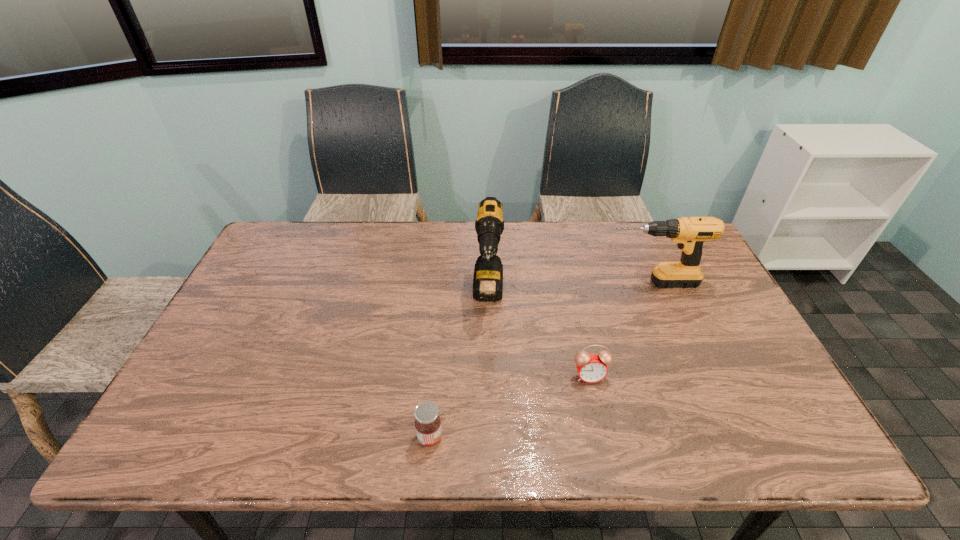
The height and width of the screenshot is (540, 960). Identify the location of empty location between the leftmost object and the third farthest object. (510, 407).

The height and width of the screenshot is (540, 960). Identify the location of empty space between the left drill and the third object from left to right. (539, 336).

I want to click on free space between the left drill and the jam, so click(459, 367).

At what (x,y) coordinates should I click in order to perform the action: click on empty space between the second object from left to right and the leftmost object. Please return your answer as a coordinate pair (x, y). The width and height of the screenshot is (960, 540). Looking at the image, I should click on (459, 367).

Locate an element on the screen. Image resolution: width=960 pixels, height=540 pixels. free space between the right drill and the left drill is located at coordinates (569, 289).

Image resolution: width=960 pixels, height=540 pixels. I want to click on free point between the second object from left to right and the jam, so click(x=459, y=367).

In order to click on vacant area that lies between the third farthest object and the right drill in this screenshot , I will do tap(619, 330).

This screenshot has height=540, width=960. I want to click on unoccupied area between the right drill and the jam, so click(x=540, y=360).

The width and height of the screenshot is (960, 540). Find the location of `free space between the left drill and the third object from left to right`. free space between the left drill and the third object from left to right is located at coordinates (539, 336).

Locate an element on the screen. empty location between the third farthest object and the left drill is located at coordinates (539, 336).